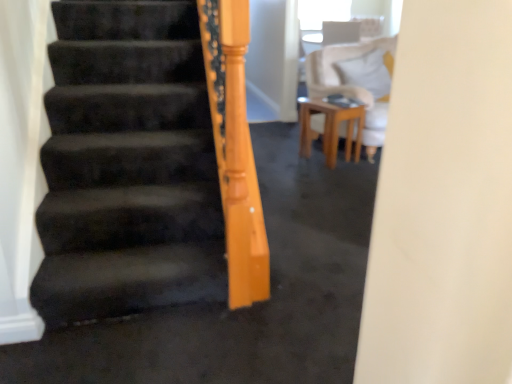
Question: Does white soft pillow at upper right have a greater height compared to transparent plastic window screen at upper center?

Choices:
 (A) no
 (B) yes

Answer: (B)

Question: Can you confirm if white soft pillow at upper right is positioned to the right of transparent plastic window screen at upper center?

Choices:
 (A) yes
 (B) no

Answer: (B)

Question: From a real-world perspective, is white soft pillow at upper right positioned over transparent plastic window screen at upper center based on gravity?

Choices:
 (A) no
 (B) yes

Answer: (A)

Question: Can you confirm if white soft pillow at upper right is bigger than transparent plastic window screen at upper center?

Choices:
 (A) yes
 (B) no

Answer: (A)

Question: Is white soft pillow at upper right outside transparent plastic window screen at upper center?

Choices:
 (A) yes
 (B) no

Answer: (A)

Question: Considering the relative positions of wooden table at center and transparent plastic window screen at upper center in the image provided, is wooden table at center to the left or to the right of transparent plastic window screen at upper center?

Choices:
 (A) left
 (B) right

Answer: (A)

Question: Would you say wooden table at center is inside or outside transparent plastic window screen at upper center?

Choices:
 (A) inside
 (B) outside

Answer: (B)

Question: From the image's perspective, is wooden table at center above or below transparent plastic window screen at upper center?

Choices:
 (A) above
 (B) below

Answer: (B)

Question: Does point (358, 107) appear closer or farther from the camera than point (303, 1)?

Choices:
 (A) closer
 (B) farther

Answer: (A)

Question: Would you say transparent plastic window screen at upper center is to the left or to the right of wooden table at center in the picture?

Choices:
 (A) right
 (B) left

Answer: (A)

Question: From a real-world perspective, is transparent plastic window screen at upper center above or below wooden table at center?

Choices:
 (A) below
 (B) above

Answer: (B)

Question: Looking at the image, does transparent plastic window screen at upper center seem bigger or smaller compared to wooden table at center?

Choices:
 (A) small
 (B) big

Answer: (B)

Question: Relative to wooden table at center, is transparent plastic window screen at upper center in front or behind?

Choices:
 (A) behind
 (B) front

Answer: (A)

Question: Looking at the image, does white soft pillow at upper right seem bigger or smaller compared to transparent plastic window screen at upper center?

Choices:
 (A) big
 (B) small

Answer: (A)

Question: From the image's perspective, is white soft pillow at upper right located above or below transparent plastic window screen at upper center?

Choices:
 (A) above
 (B) below

Answer: (B)